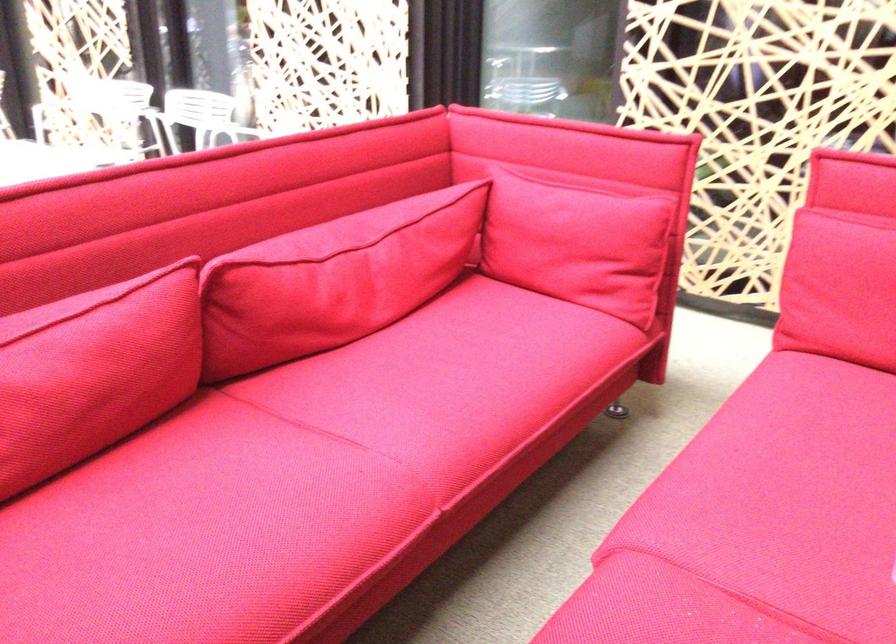
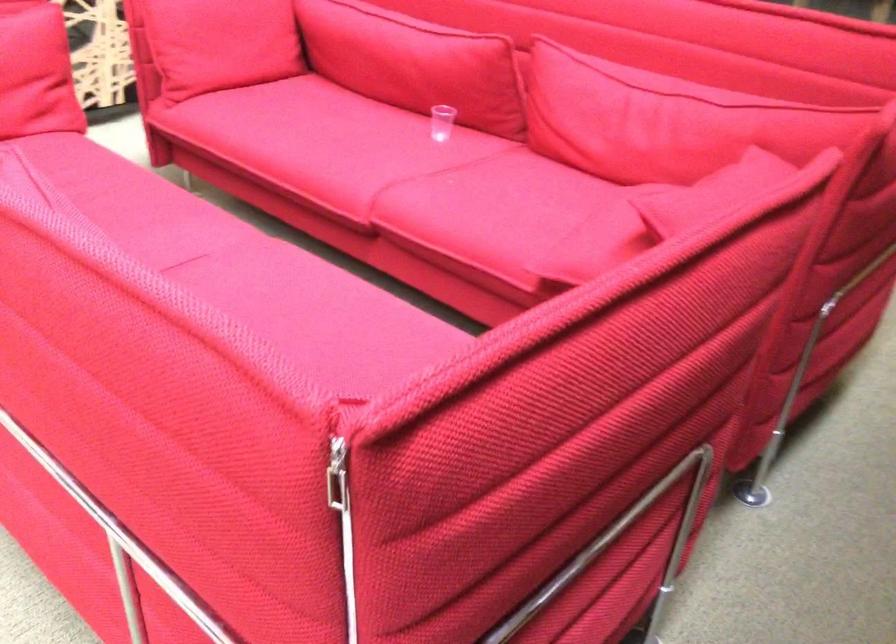
Question: I am providing you with two images of the same scene from different viewpoints. Which of the following objects are not visible in image2?

Choices:
 (A) red sofa sitting surface
 (B) red sofa armrest
 (C) white hanging tag
 (D) red sofa cushion

Answer: (D)